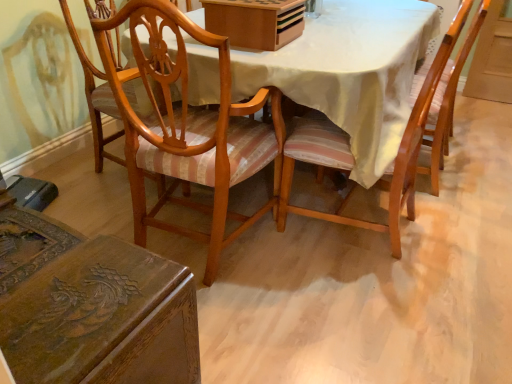
The image size is (512, 384). In order to click on polished wood chair at lower left, which is the 1th chair from left to right in this screenshot , I will do `click(91, 307)`.

Identify the location of wooden chair with striped cushion at center, the first chair from the right. (401, 140).

Is wooden chair with striped cushion at center, the first chair from the right, to the left or to the right of wooden box at upper center in the image?

Based on their positions, wooden chair with striped cushion at center, the first chair from the right, is located to the right of wooden box at upper center.

From a real-world perspective, between wooden chair with striped cushion at center, which appears as the third chair when viewed from the left, and wooden box at upper center, who is vertically higher?

wooden box at upper center.

There is a wooden box at upper center. Where is `the 1st chair below it (from a real-world perspective)`? the 1st chair below it (from a real-world perspective) is located at coordinates (401, 140).

Is wooden chair with striped cushion at center, the first chair from the right, shorter than wooden box at upper center?

No, wooden chair with striped cushion at center, the first chair from the right, is not shorter than wooden box at upper center.

Is wooden chair with striped cushion at center, positioned as the 2th chair in right-to-left order, positioned with its back to wooden box at upper center?

wooden chair with striped cushion at center, positioned as the 2th chair in right-to-left order, does not have its back to wooden box at upper center.

From the image's perspective, relative to wooden box at upper center, is wooden chair with striped cushion at center, positioned as the 2th chair in right-to-left order, above or below?

From the image's perspective, wooden chair with striped cushion at center, positioned as the 2th chair in right-to-left order, appears below wooden box at upper center.

Is wooden chair with striped cushion at center, placed as the second chair when sorted from left to right, outside of wooden box at upper center?

Indeed, wooden chair with striped cushion at center, placed as the second chair when sorted from left to right, is completely outside wooden box at upper center.

Is point (98, 140) positioned behind point (240, 7)?

Yes, it is.

Is wooden chair with striped cushion at center, placed as the second chair when sorted from left to right, thinner than polished wood chair at lower left, the third chair in the right-to-left sequence?

No, wooden chair with striped cushion at center, placed as the second chair when sorted from left to right, is not thinner than polished wood chair at lower left, the third chair in the right-to-left sequence.

From a real-world perspective, is wooden chair with striped cushion at center, placed as the second chair when sorted from left to right, positioned under polished wood chair at lower left, which is the 1th chair from left to right, based on gravity?

No.

Is wooden chair with striped cushion at center, placed as the second chair when sorted from left to right, oriented towards polished wood chair at lower left, the third chair in the right-to-left sequence?

No, wooden chair with striped cushion at center, placed as the second chair when sorted from left to right, does not turn towards polished wood chair at lower left, the third chair in the right-to-left sequence.

Which object is positioned more to the right, wooden chair with striped cushion at center, placed as the second chair when sorted from left to right, or polished wood chair at lower left, the third chair in the right-to-left sequence?

wooden chair with striped cushion at center, placed as the second chair when sorted from left to right.

Considering the sizes of objects polished wood chair at lower left, the third chair in the right-to-left sequence, and wooden chair with striped cushion at center, positioned as the 2th chair in right-to-left order, in the image provided, who is smaller, polished wood chair at lower left, the third chair in the right-to-left sequence, or wooden chair with striped cushion at center, positioned as the 2th chair in right-to-left order,?

polished wood chair at lower left, the third chair in the right-to-left sequence.

Where is `the 1st chair to the right of the polished wood chair at lower left, the third chair in the right-to-left sequence, starting your count from the anchor`? The width and height of the screenshot is (512, 384). the 1st chair to the right of the polished wood chair at lower left, the third chair in the right-to-left sequence, starting your count from the anchor is located at coordinates (180, 123).

Is polished wood chair at lower left, which is the 1th chair from left to right, inside or outside of wooden chair with striped cushion at center, placed as the second chair when sorted from left to right?

polished wood chair at lower left, which is the 1th chair from left to right, is spatially situated outside wooden chair with striped cushion at center, placed as the second chair when sorted from left to right.

Which is farther from the camera, (175, 303) or (81, 49)?

The point (81, 49) is farther from the camera.

Locate an element on the screen. Image resolution: width=512 pixels, height=384 pixels. chair that is the 1st object directly below the wooden box at upper center (from a real-world perspective) is located at coordinates 401,140.

Is wooden box at upper center oriented towards wooden chair with striped cushion at center, the first chair from the right?

Yes, wooden box at upper center is facing wooden chair with striped cushion at center, the first chair from the right.

In the scene shown: Is wooden box at upper center wider than wooden chair with striped cushion at center, which appears as the third chair when viewed from the left?

No, wooden box at upper center is not wider than wooden chair with striped cushion at center, which appears as the third chair when viewed from the left.

From the picture: Is wooden chair with striped cushion at center, positioned as the 2th chair in right-to-left order, inside the boundaries of wooden chair with striped cushion at center, which appears as the third chair when viewed from the left, or outside?

wooden chair with striped cushion at center, positioned as the 2th chair in right-to-left order, lies outside wooden chair with striped cushion at center, which appears as the third chair when viewed from the left.

Identify the location of chair that is the 1st one when counting downward from the wooden chair with striped cushion at center, which appears as the third chair when viewed from the left (from the image's perspective). (180, 123).

In the scene shown: Which of these two, wooden chair with striped cushion at center, positioned as the 2th chair in right-to-left order, or wooden chair with striped cushion at center, the first chair from the right, stands taller?

wooden chair with striped cushion at center, positioned as the 2th chair in right-to-left order.

From the image's perspective, is wooden chair with striped cushion at center, placed as the second chair when sorted from left to right, beneath wooden chair with striped cushion at center, which appears as the third chair when viewed from the left?

Yes, from the image's perspective, wooden chair with striped cushion at center, placed as the second chair when sorted from left to right, is beneath wooden chair with striped cushion at center, which appears as the third chair when viewed from the left.

Where is `box that appears on the right of polished wood chair at lower left, which is the 1th chair from left to right`? Image resolution: width=512 pixels, height=384 pixels. box that appears on the right of polished wood chair at lower left, which is the 1th chair from left to right is located at coordinates (255, 22).

What's the angular difference between polished wood chair at lower left, which is the 1th chair from left to right, and wooden box at upper center's facing directions?

87 degrees separate the facing orientations of polished wood chair at lower left, which is the 1th chair from left to right, and wooden box at upper center.

Is polished wood chair at lower left, which is the 1th chair from left to right, placed right next to wooden box at upper center?

No, polished wood chair at lower left, which is the 1th chair from left to right, is not touching wooden box at upper center.

Is polished wood chair at lower left, which is the 1th chair from left to right, wider than wooden box at upper center?

Correct, the width of polished wood chair at lower left, which is the 1th chair from left to right, exceeds that of wooden box at upper center.

In order to click on chair that is the 1st object located in front of the wooden box at upper center in this screenshot , I will do `click(401, 140)`.

From the image's perspective, starting from the wooden box at upper center, which chair is the 2nd one below? Please provide its 2D coordinates.

[(180, 123)]

From the image, which object appears to be nearer to polished wood chair at lower left, which is the 1th chair from left to right, wooden chair with striped cushion at center, positioned as the 2th chair in right-to-left order, or wooden chair with striped cushion at center, the first chair from the right?

wooden chair with striped cushion at center, positioned as the 2th chair in right-to-left order, lies closer to polished wood chair at lower left, which is the 1th chair from left to right, than the other object.

Which object lies further to the anchor point polished wood chair at lower left, which is the 1th chair from left to right, wooden chair with striped cushion at center, which appears as the third chair when viewed from the left, or wooden chair with striped cushion at center, placed as the second chair when sorted from left to right?

wooden chair with striped cushion at center, which appears as the third chair when viewed from the left.

Based on their spatial positions, is wooden chair with striped cushion at center, the first chair from the right, or wooden box at upper center further from polished wood chair at lower left, which is the 1th chair from left to right?

Among the two, wooden box at upper center is located further to polished wood chair at lower left, which is the 1th chair from left to right.

When comparing their distances from wooden box at upper center, does wooden chair with striped cushion at center, positioned as the 2th chair in right-to-left order, or polished wood chair at lower left, the third chair in the right-to-left sequence, seem closer?

Based on the image, wooden chair with striped cushion at center, positioned as the 2th chair in right-to-left order, appears to be nearer to wooden box at upper center.

When comparing their distances from wooden box at upper center, does wooden chair with striped cushion at center, which appears as the third chair when viewed from the left, or polished wood chair at lower left, which is the 1th chair from left to right, seem further?

polished wood chair at lower left, which is the 1th chair from left to right, is further to wooden box at upper center.

Estimate the real-world distances between objects in this image. Which object is further from polished wood chair at lower left, which is the 1th chair from left to right, wooden chair with striped cushion at center, positioned as the 2th chair in right-to-left order, or wooden box at upper center?

Based on the image, wooden box at upper center appears to be further to polished wood chair at lower left, which is the 1th chair from left to right.

Which object lies further to the anchor point polished wood chair at lower left, which is the 1th chair from left to right, wooden box at upper center or wooden chair with striped cushion at center, placed as the second chair when sorted from left to right?

Based on the image, wooden box at upper center appears to be further to polished wood chair at lower left, which is the 1th chair from left to right.

Which object lies further to the anchor point wooden chair with striped cushion at center, which appears as the third chair when viewed from the left, polished wood chair at lower left, the third chair in the right-to-left sequence, or wooden box at upper center?

polished wood chair at lower left, the third chair in the right-to-left sequence, is positioned further to the anchor wooden chair with striped cushion at center, which appears as the third chair when viewed from the left.

Where is `chair located between polished wood chair at lower left, the third chair in the right-to-left sequence, and wooden chair with striped cushion at center, the first chair from the right, in the left-right direction`? The width and height of the screenshot is (512, 384). chair located between polished wood chair at lower left, the third chair in the right-to-left sequence, and wooden chair with striped cushion at center, the first chair from the right, in the left-right direction is located at coordinates (180, 123).

What are the coordinates of `box between polished wood chair at lower left, the third chair in the right-to-left sequence, and wooden chair with striped cushion at center, which appears as the third chair when viewed from the left` in the screenshot? It's located at (255, 22).

Locate an element on the screen. The width and height of the screenshot is (512, 384). box located between wooden chair with striped cushion at center, positioned as the 2th chair in right-to-left order, and wooden chair with striped cushion at center, the first chair from the right, in the left-right direction is located at coordinates (255, 22).